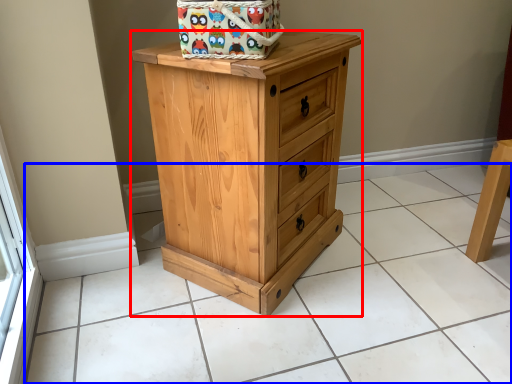
Question: Which object appears closest to the camera in this image, chest of drawers (highlighted by a red box) or tile (highlighted by a blue box)?

Choices:
 (A) chest of drawers
 (B) tile

Answer: (B)